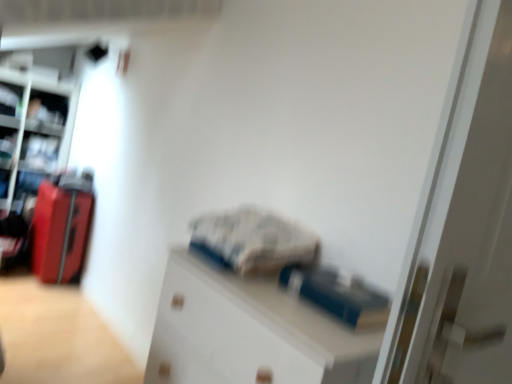
Question: Looking at their shapes, would you say metallic silver bookshelf at left is wider or thinner than white matte cabinet at center?

Choices:
 (A) thin
 (B) wide

Answer: (B)

Question: Considering the positions of metallic silver bookshelf at left and white matte cabinet at center in the image, is metallic silver bookshelf at left bigger or smaller than white matte cabinet at center?

Choices:
 (A) big
 (B) small

Answer: (A)

Question: Based on their relative distances, which object is farther from the white glossy door at center?

Choices:
 (A) white matte cabinet at center
 (B) matte red suitcase at left
 (C) metallic silver bookshelf at left
 (D) matte black shelf at upper left

Answer: (D)

Question: Which object is the farthest from the matte black shelf at upper left?

Choices:
 (A) matte red suitcase at left
 (B) white glossy door at center
 (C) metallic silver bookshelf at left
 (D) white matte cabinet at center

Answer: (B)